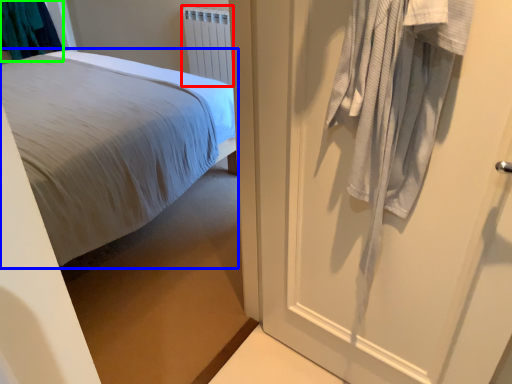
Question: Which is farther away from radiator (highlighted by a red box)? bed (highlighted by a blue box) or laundry (highlighted by a green box)?

Choices:
 (A) bed
 (B) laundry

Answer: (B)